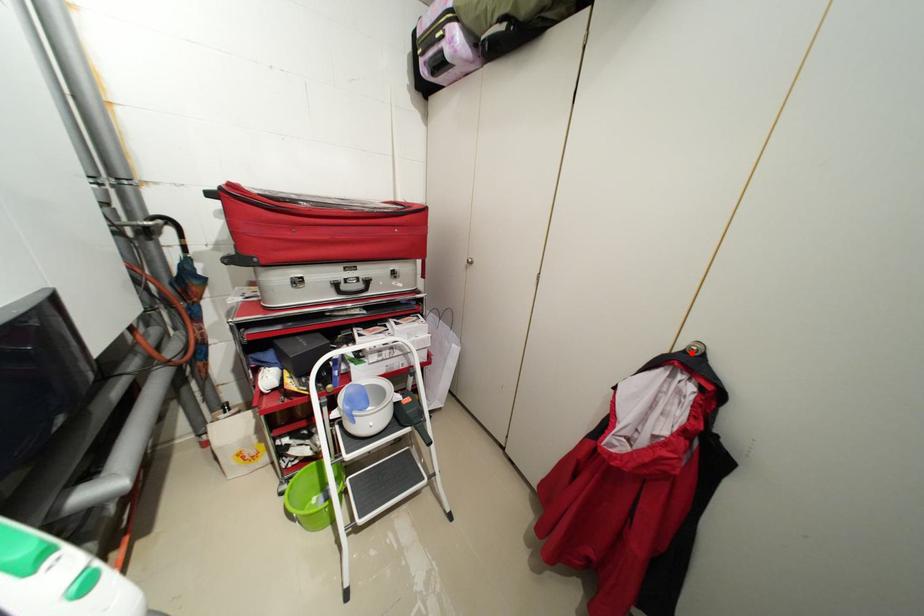
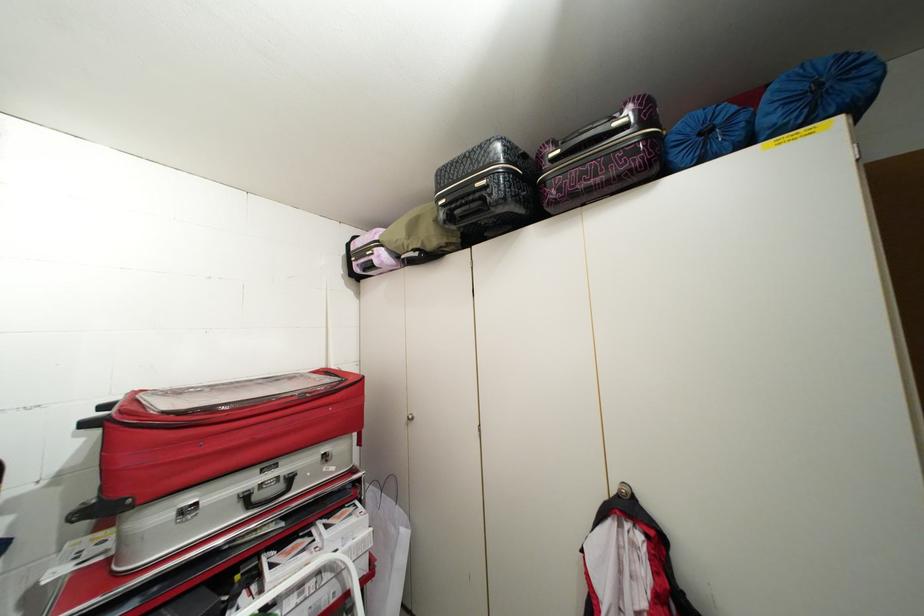
Where in the second image is the point corresponding to the highlighted location from the first image?

(626, 496)